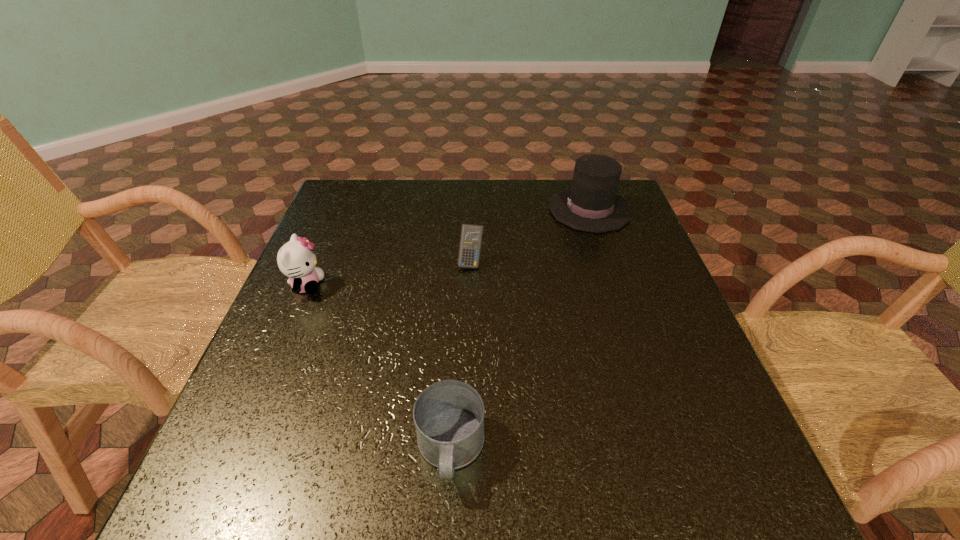
This screenshot has width=960, height=540. What are the coordinates of `empty space between the kitten and the farthest object` in the screenshot? It's located at tap(448, 247).

Locate an element on the screen. vacant point located between the dress hat and the nearest object is located at coordinates (520, 329).

The image size is (960, 540). In order to click on the closest object to the nearest object in this screenshot , I will do `click(296, 259)`.

Find the location of `the closest object to the rightmost object`. the closest object to the rightmost object is located at coordinates (471, 236).

I want to click on vacant point that satisfies the following two spatial constraints: 1. on the front-facing side of the second shortest object; 2. on the front-facing side of the kitten, so click(470, 286).

Locate an element on the screen. This screenshot has width=960, height=540. vacant space that satisfies the following two spatial constraints: 1. on the front of the farthest object with the decoration; 2. on the front-facing side of the second shortest object is located at coordinates (608, 263).

Identify the location of vacant space that satisfies the following two spatial constraints: 1. on the front-facing side of the calculator; 2. on the front-facing side of the leftmost object. Image resolution: width=960 pixels, height=540 pixels. (470, 286).

Image resolution: width=960 pixels, height=540 pixels. I want to click on vacant space that satisfies the following two spatial constraints: 1. on the front of the dress hat with the decoration; 2. on the side of the mug with the handle, so click(669, 449).

Find the location of `vacant space that satisfies the following two spatial constraints: 1. on the front of the dress hat with the decoration; 2. on the side of the shortest object with the handle`. vacant space that satisfies the following two spatial constraints: 1. on the front of the dress hat with the decoration; 2. on the side of the shortest object with the handle is located at coordinates (669, 449).

The width and height of the screenshot is (960, 540). In order to click on vacant position in the image that satisfies the following two spatial constraints: 1. on the front of the rightmost object with the decoration; 2. on the side of the mug with the handle in this screenshot , I will do `click(669, 449)`.